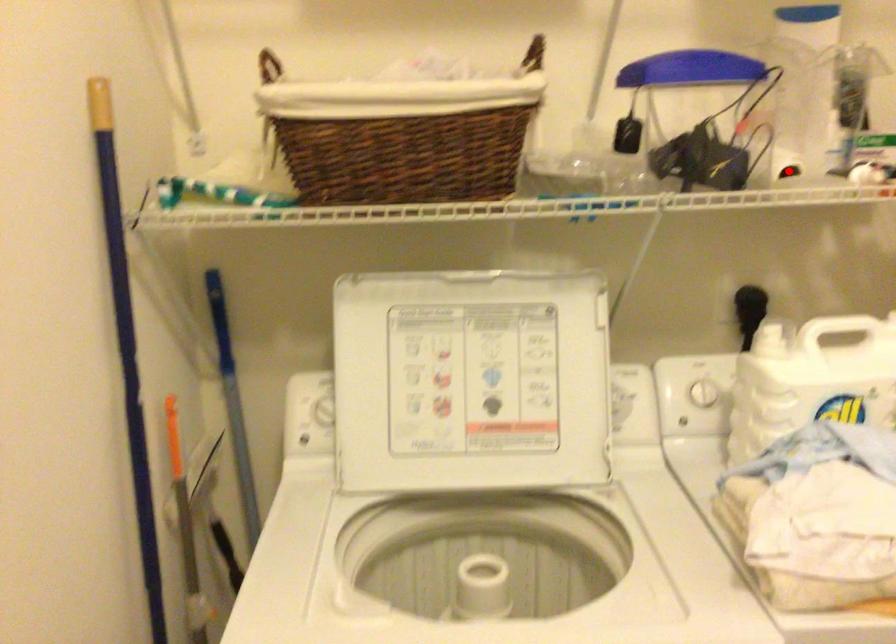
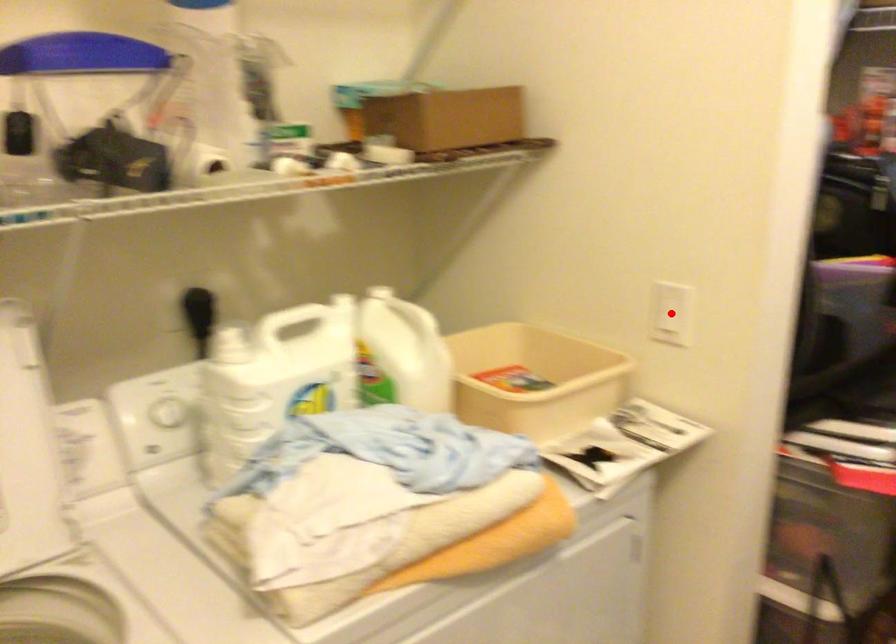
I am providing you with two images of the same scene from different viewpoints. A red point is marked on the first image and another point is marked on the second image. Does the point marked in image1 correspond to the same location as the one in image2?

No